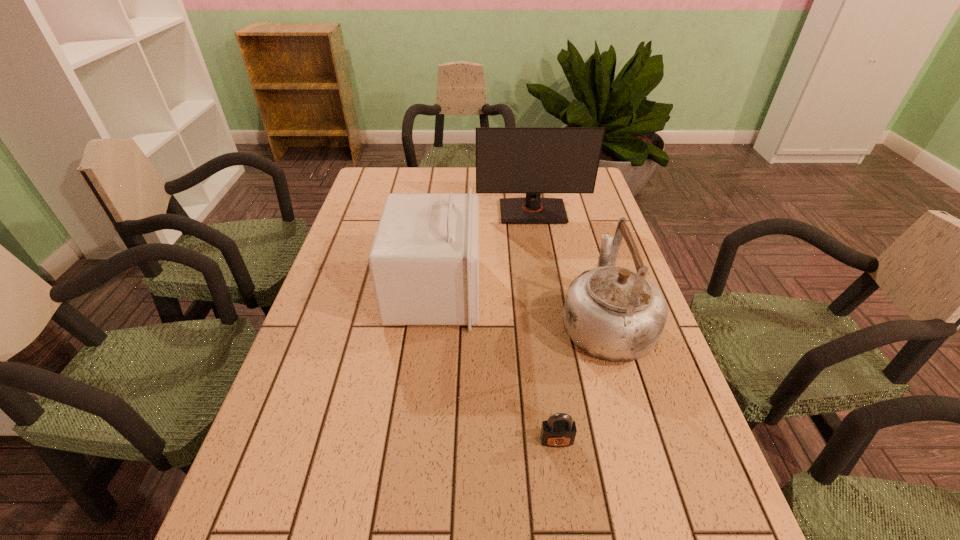
The height and width of the screenshot is (540, 960). In order to click on object that is the third nearest to the kettle in this screenshot , I will do `click(533, 160)`.

Where is `vacant space that satisfies the following two spatial constraints: 1. on the screen side of the farthest object; 2. on the front-facing side of the first-aid kit`? vacant space that satisfies the following two spatial constraints: 1. on the screen side of the farthest object; 2. on the front-facing side of the first-aid kit is located at coordinates [545, 291].

This screenshot has height=540, width=960. Find the location of `vacant area in the image that satisfies the following two spatial constraints: 1. on the screen side of the monitor; 2. on the front-facing side of the first-aid kit`. vacant area in the image that satisfies the following two spatial constraints: 1. on the screen side of the monitor; 2. on the front-facing side of the first-aid kit is located at coordinates (545, 291).

In order to click on free space that satisfies the following two spatial constraints: 1. at the spout of the kettle; 2. on the front-facing side of the first-aid kit in this screenshot , I will do (596, 291).